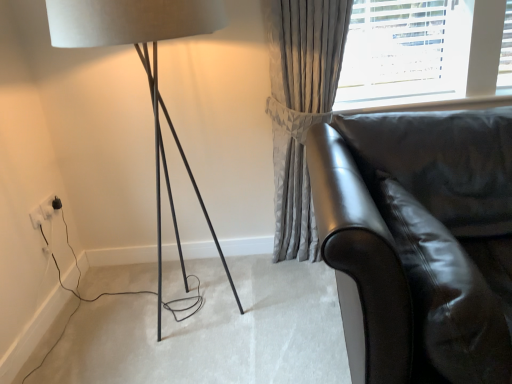
Question: Would you say matte black lamp at left is part of white plastic electric outlet at lower left, which is counted as the 2th electric outlet, starting from the back,'s contents?

Choices:
 (A) no
 (B) yes

Answer: (A)

Question: Are white plastic electric outlet at lower left, which is counted as the 2th electric outlet, starting from the back, and matte black lamp at left far apart?

Choices:
 (A) yes
 (B) no

Answer: (B)

Question: Can you confirm if white plastic electric outlet at lower left, acting as the first electric outlet starting from the front, is shorter than matte black lamp at left?

Choices:
 (A) yes
 (B) no

Answer: (A)

Question: Considering the relative positions of white plastic electric outlet at lower left, acting as the first electric outlet starting from the front, and matte black lamp at left in the image provided, is white plastic electric outlet at lower left, acting as the first electric outlet starting from the front, to the left of matte black lamp at left from the viewer's perspective?

Choices:
 (A) yes
 (B) no

Answer: (A)

Question: Does white plastic electric outlet at lower left, acting as the first electric outlet starting from the front, lie in front of matte black lamp at left?

Choices:
 (A) yes
 (B) no

Answer: (B)

Question: From a real-world perspective, is shiny black leather couch at right above or below matte black lamp at left?

Choices:
 (A) above
 (B) below

Answer: (B)

Question: Considering the positions of shiny black leather couch at right and matte black lamp at left in the image, is shiny black leather couch at right wider or thinner than matte black lamp at left?

Choices:
 (A) wide
 (B) thin

Answer: (A)

Question: From the image's perspective, is shiny black leather couch at right above or below matte black lamp at left?

Choices:
 (A) above
 (B) below

Answer: (B)

Question: Is shiny black leather couch at right inside the boundaries of matte black lamp at left, or outside?

Choices:
 (A) inside
 (B) outside

Answer: (B)

Question: Is point (38, 211) positioned closer to the camera than point (356, 175)?

Choices:
 (A) farther
 (B) closer

Answer: (A)

Question: Based on their positions, is white plastic electric outlet at lower left, acting as the first electric outlet starting from the front, located to the left or right of shiny black leather couch at right?

Choices:
 (A) left
 (B) right

Answer: (A)

Question: Do you think white plastic electric outlet at lower left, which is counted as the 2th electric outlet, starting from the back, is within shiny black leather couch at right, or outside of it?

Choices:
 (A) outside
 (B) inside

Answer: (A)

Question: Looking at their shapes, would you say white plastic electric outlet at lower left, acting as the first electric outlet starting from the front, is wider or thinner than shiny black leather couch at right?

Choices:
 (A) wide
 (B) thin

Answer: (B)

Question: Considering the positions of matte black lamp at left and glossy leather swivel chair at lower right in the image, is matte black lamp at left taller or shorter than glossy leather swivel chair at lower right?

Choices:
 (A) short
 (B) tall

Answer: (B)

Question: Considering the positions of point (88, 43) and point (449, 233), is point (88, 43) closer or farther from the camera than point (449, 233)?

Choices:
 (A) farther
 (B) closer

Answer: (A)